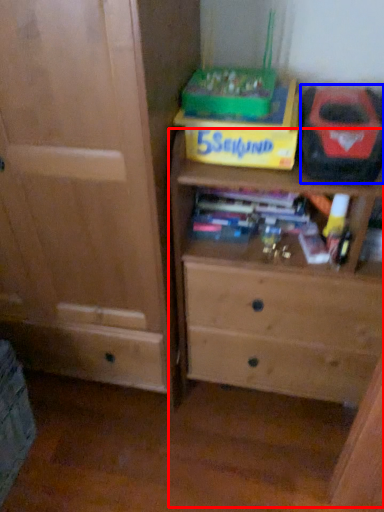
Question: Among these objects, which one is farthest to the camera, chest of drawers (highlighted by a red box) or kit (highlighted by a blue box)?

Choices:
 (A) chest of drawers
 (B) kit

Answer: (B)